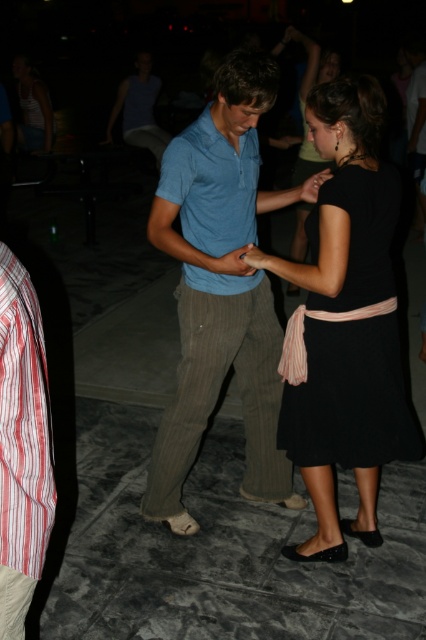
You are standing at the entrance of the party and see two points in the image. The first point is at coordinate point [264,282] and the second is at coordinate point [22,326]. Which point is closer to you?

Point [22,326] is closer to you because it is in front of point [264,282].